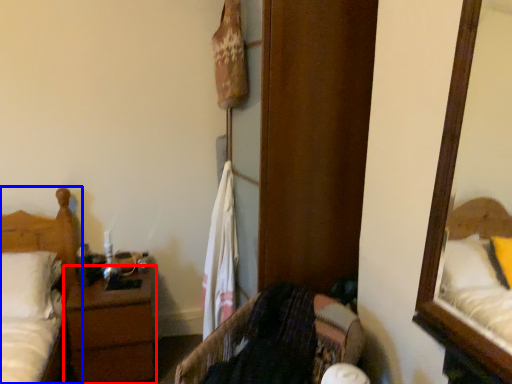
Question: Which of the following is the farthest to the observer, nightstand (highlighted by a red box) or bed (highlighted by a blue box)?

Choices:
 (A) nightstand
 (B) bed

Answer: (A)